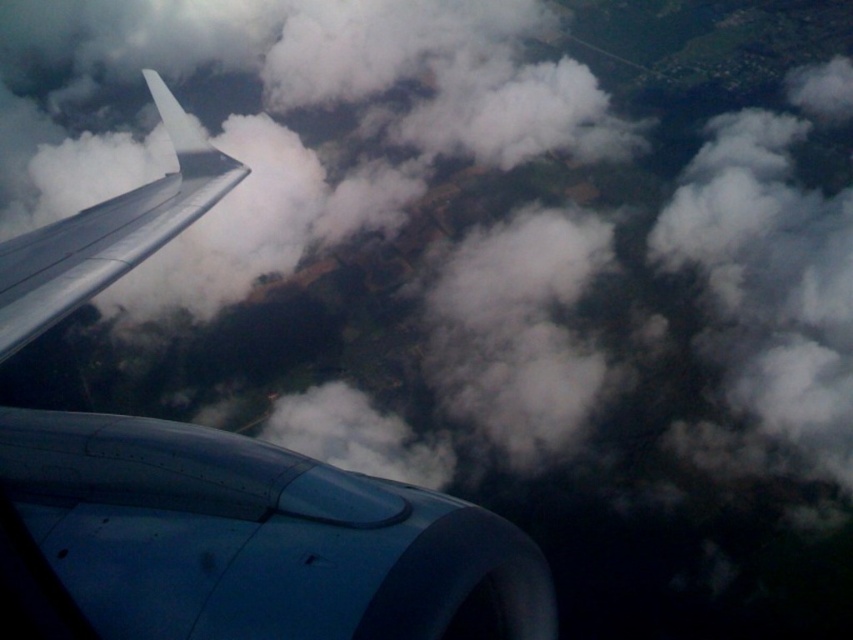
Can you confirm if metallic blue engine at lower left is smaller than metallic gray wing at upper left?

Indeed, metallic blue engine at lower left has a smaller size compared to metallic gray wing at upper left.

Is point (335, 481) less distant than point (131, 243)?

Yes, it is in front of point (131, 243).

Where is `metallic blue engine at lower left`? This screenshot has height=640, width=853. metallic blue engine at lower left is located at coordinates (247, 540).